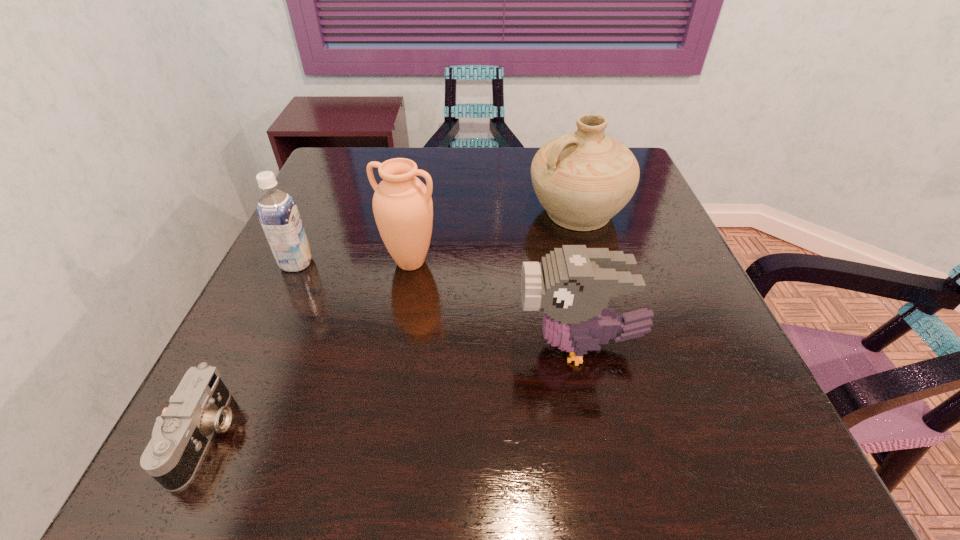
You are a GUI agent. You are given a task and a screenshot of the screen. Output one action in this format:
    pyautogui.click(x=<x>, y=<y>)
    Task: Click on the vacant space situated 0.090m at the beak of the fourth farthest object
    Image resolution: width=960 pixels, height=540 pixels.
    Given the screenshot: What is the action you would take?
    pyautogui.click(x=469, y=346)

This screenshot has width=960, height=540. What are the coordinates of `vacant region located 0.060m at the beak of the fourth farthest object` in the screenshot? It's located at (486, 346).

Locate an element on the screen. vacant area situated on the lens of the nearest object is located at coordinates (275, 436).

Find the location of a particular element. The height and width of the screenshot is (540, 960). object situated at the far edge is located at coordinates (582, 179).

Locate an element on the screen. The width and height of the screenshot is (960, 540). object situated at the near edge is located at coordinates (180, 437).

Where is `soya milk at the left edge`? soya milk at the left edge is located at coordinates (277, 211).

At what (x,y) coordinates should I click in order to perform the action: click on camera that is at the left edge. Please return your answer as a coordinate pair (x, y). The image size is (960, 540). Looking at the image, I should click on (180, 437).

The height and width of the screenshot is (540, 960). I want to click on object at the right edge, so point(582,179).

Where is `object positioned at the near left corner`? This screenshot has width=960, height=540. object positioned at the near left corner is located at coordinates (180, 437).

Image resolution: width=960 pixels, height=540 pixels. Identify the location of object located at the far right corner. (582, 179).